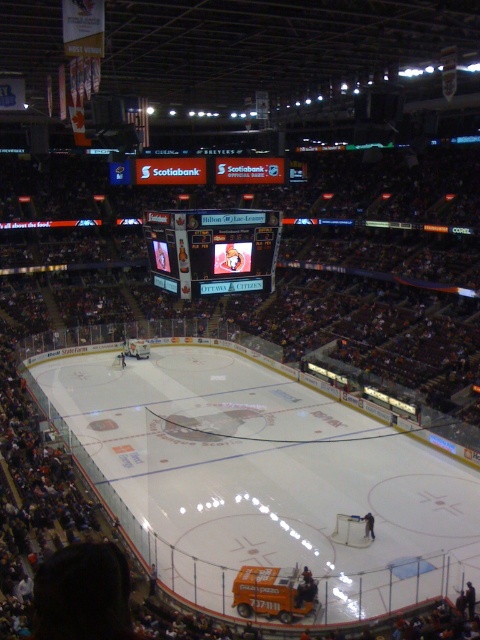
Between point (178, 486) and point (239, 280), which one is positioned behind?

Point (178, 486)

Can you confirm if white smooth ice at center is thinner than shiny digital display at center?

No, white smooth ice at center is not thinner than shiny digital display at center.

Is point (226, 412) farther from viewer compared to point (170, 269)?

Yes, it is behind point (170, 269).

Locate an element on the screen. white smooth ice at center is located at coordinates [260, 476].